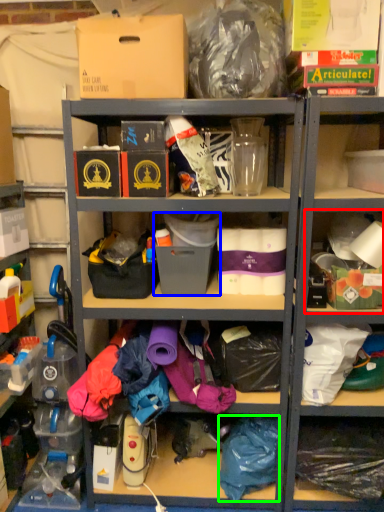
Question: Which object is the farthest from shelf (highlighted by a red box)? Choose among these: storage box (highlighted by a blue box) or clothing (highlighted by a green box).

Choices:
 (A) storage box
 (B) clothing

Answer: (B)